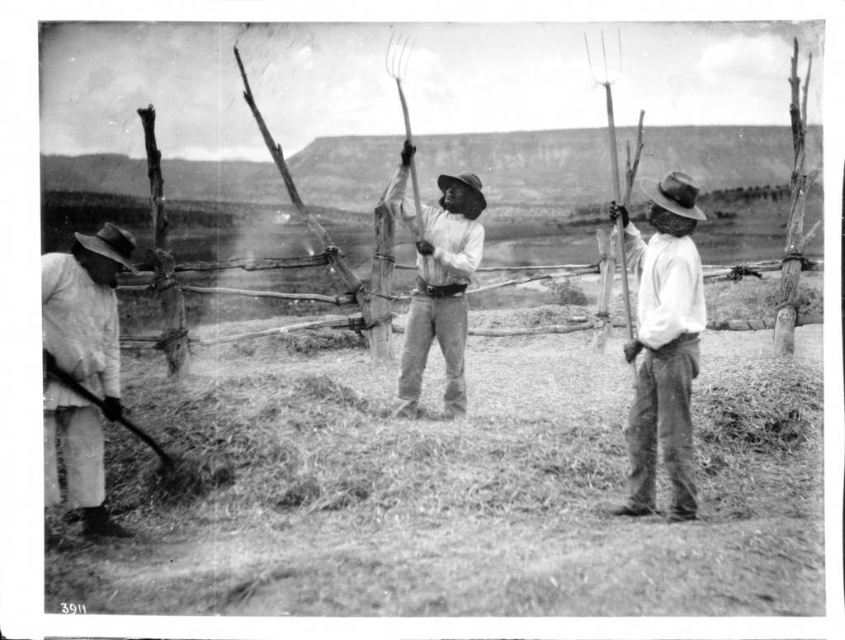
Question: Which of the following is the farthest from the observer?

Choices:
 (A) (644, 316)
 (B) (106, 410)

Answer: (A)

Question: Does white cotton shirt at left have a larger size compared to smooth wood pitchfork at center?

Choices:
 (A) no
 (B) yes

Answer: (A)

Question: Among these objects, which one is nearest to the camera?

Choices:
 (A) smooth white shirt at right
 (B) smooth wood pitchfork at center

Answer: (A)

Question: Can you confirm if smooth white shirt at right is wider than white cotton shirt at left?

Choices:
 (A) yes
 (B) no

Answer: (A)

Question: Which object is closer to the camera taking this photo?

Choices:
 (A) white cotton shirt at left
 (B) smooth white shirt at right
 (C) smooth wood pitchfork at center

Answer: (A)

Question: Is smooth white shirt at right thinner than smooth wood pitchfork at center?

Choices:
 (A) no
 (B) yes

Answer: (B)